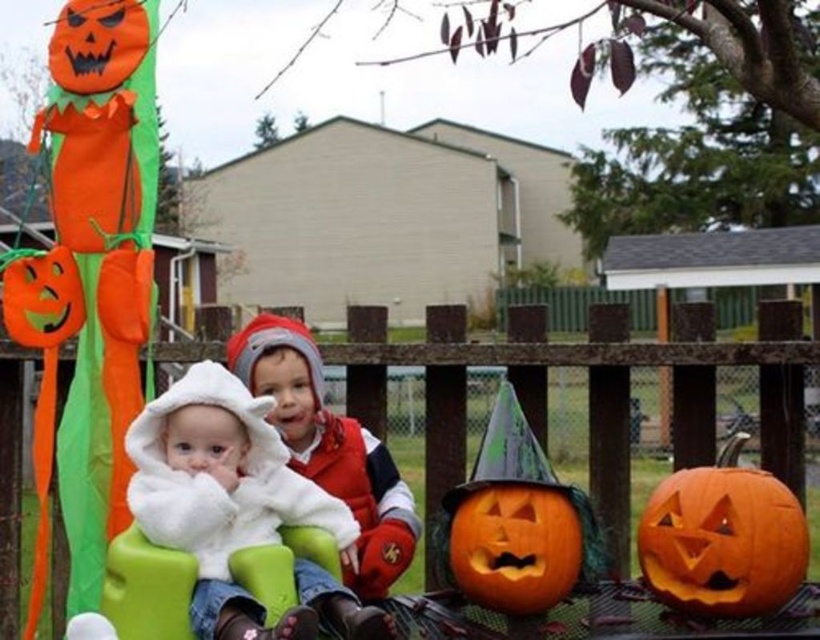
Which is in front, point (260, 612) or point (62, 280)?

Point (260, 612) is in front.

This screenshot has width=820, height=640. What do you see at coordinates (237, 508) in the screenshot? I see `white fluffy coat at center` at bounding box center [237, 508].

The height and width of the screenshot is (640, 820). I want to click on white fluffy coat at center, so click(237, 508).

Which is in front, point (276, 404) or point (20, 330)?

Point (276, 404) is in front.

Is point (371, 584) positioned before point (52, 342)?

Yes, it is.

Is point (276, 317) positioned after point (7, 275)?

Yes, it is.

This screenshot has height=640, width=820. I want to click on white fleece hat at center, so click(329, 445).

Who is more distant from viewer, (545, 525) or (83, 316)?

Positioned behind is point (83, 316).

Can you confirm if orange matte pumpkin at lower right is positioned below orange matte pumpkin at left?

Yes, orange matte pumpkin at lower right is below orange matte pumpkin at left.

Between point (527, 563) and point (82, 316), which one is positioned in front?

Point (527, 563)

Find the location of a particular element. orange matte pumpkin at lower right is located at coordinates (513, 547).